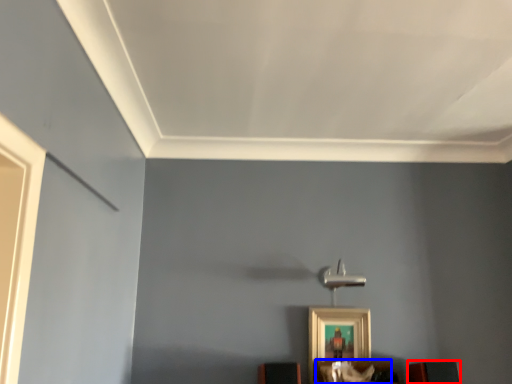
Question: Which point is further to the camera, furniture (highlighted by a red box) or furniture (highlighted by a blue box)?

Choices:
 (A) furniture
 (B) furniture

Answer: (A)